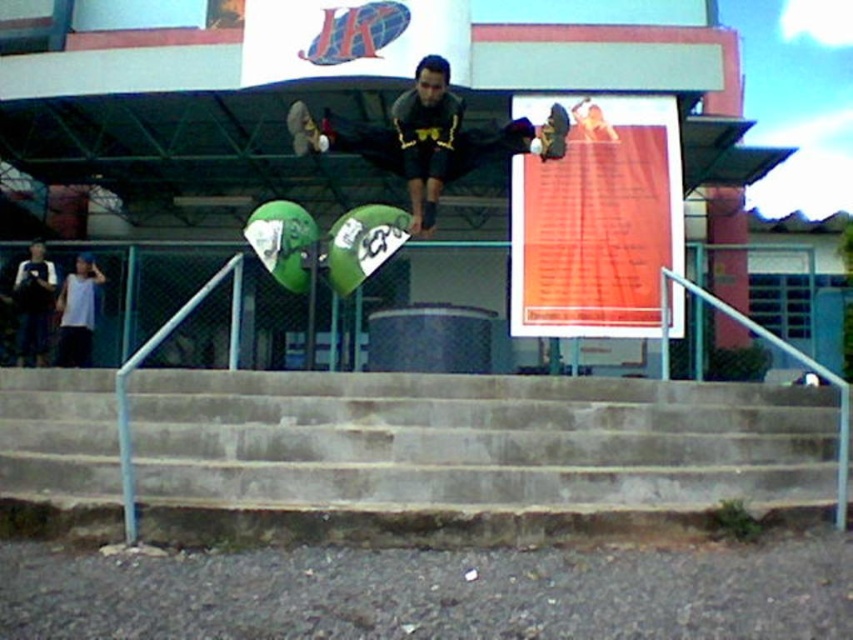
You are a photographer trying to capture the skateboarder midair. You need to know which object between the concrete stairs at center and the green matte skateboard at center is higher to adjust your camera angle. Which one is taller?

The concrete stairs at center is much taller than the green matte skateboard at center, so you should adjust your camera angle to focus on the concrete stairs at center.

You are a photographer trying to capture the skateboarder midair. The matte black skateboard at center is at point 0.217, 0.488. If your camera has a focus point at 0.2, 0.5, will it be able to focus on the skateboard?

The matte black skateboard at center is at point [415,138]. The camera focus point is at [426,128]. The distance between the two points is sqrt of squared differences in x and y coordinates. The difference in x is 0.017, and in y is 0.012. Squared and summed is 0.000289 plus 0.000144 equals 0.000433. Square root is approx 0.0208. If the camera focus tolerance is within 0.02, then yes. However, since the exact tolerance isn t specified, but the coordinates are very close, it might be within range. The best